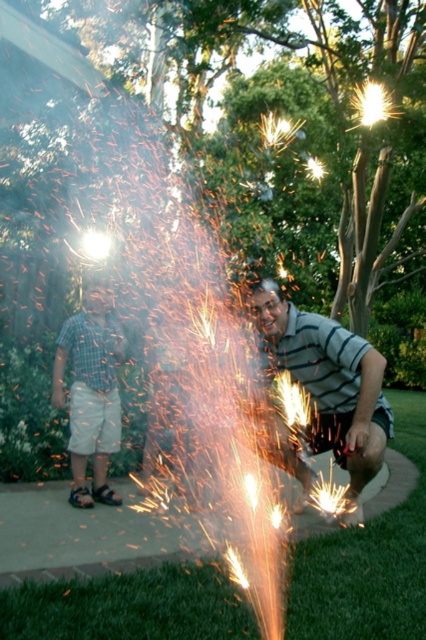
You are standing in the festive scene and want to walk from the point closer to you to the farther point. Which path would you take between the two points, point (327,369) and point (83,444)?

You should walk from point (327,369) to point (83,444) because point (327,369) is closer to the viewer and the other is farther away.